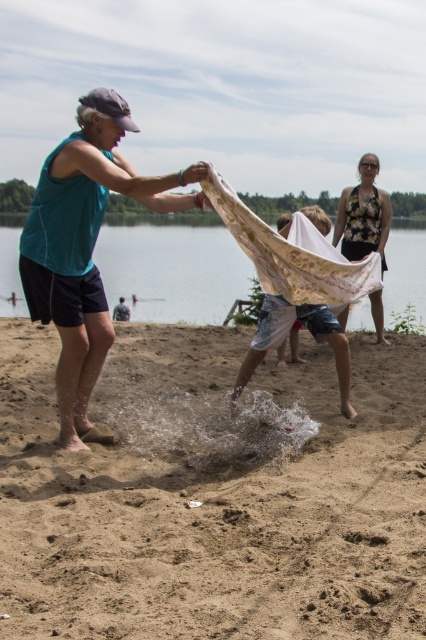
Between white lace towel at center and floral fabric dress at upper right, which one has more height?

Standing taller between the two is floral fabric dress at upper right.

Is white lace towel at center to the left of floral fabric dress at upper right from the viewer's perspective?

Correct, you'll find white lace towel at center to the left of floral fabric dress at upper right.

This screenshot has height=640, width=426. Describe the element at coordinates (287, 333) in the screenshot. I see `white lace towel at center` at that location.

I want to click on white lace towel at center, so click(287, 333).

Who is shorter, brown sandy beach at center or teal fabric at center?

Standing shorter between the two is brown sandy beach at center.

Does brown sandy beach at center appear on the right side of teal fabric at center?

Correct, you'll find brown sandy beach at center to the right of teal fabric at center.

Between point (126, 474) and point (106, 168), which one is positioned behind?

The point (126, 474) is behind.

You are a GUI agent. You are given a task and a screenshot of the screen. Output one action in this format:
    pyautogui.click(x=<x>, y=<y>)
    Task: Click on the brown sandy beach at center
    
    Given the screenshot: What is the action you would take?
    pyautogui.click(x=213, y=492)

Can you confirm if translucent fabric water at center is positioned to the right of white lace towel at center?

Incorrect, translucent fabric water at center is not on the right side of white lace towel at center.

Does translucent fabric water at center lie in front of white lace towel at center?

Yes, it is in front of white lace towel at center.

Between point (184, 225) and point (345, 390), which one is positioned behind?

The point (184, 225) is behind.

Image resolution: width=426 pixels, height=640 pixels. Identify the location of translucent fabric water at center. (172, 269).